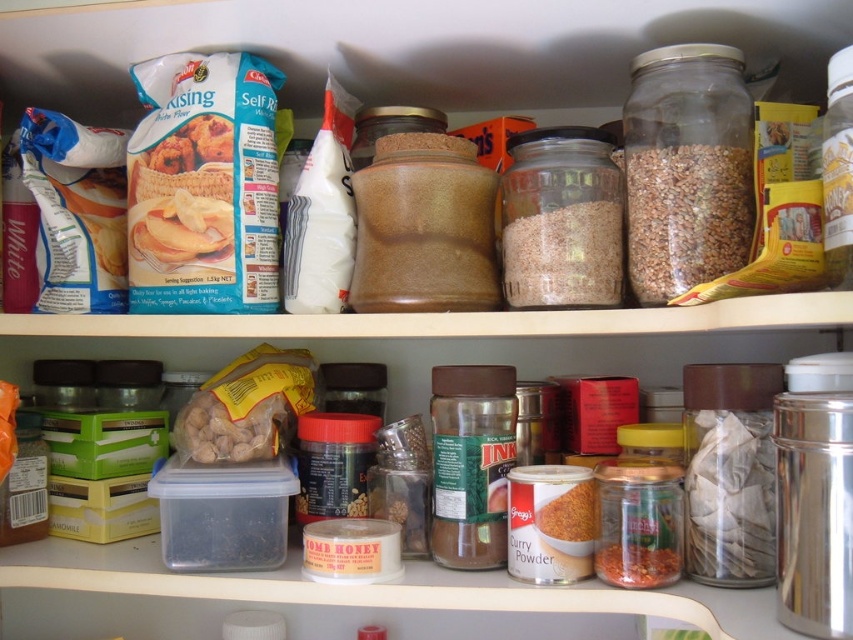
Measure the distance between point (747, 212) and camera.

28.10 inches

Identify the location of brown matte grain at upper right. The image size is (853, 640). (685, 216).

Find the location of a particular element. brown matte grain at upper right is located at coordinates (685, 216).

Does translucent glass jar at center come behind reddish-brown powder at lower center?

That is True.

Is point (531, 237) positioned in front of point (608, 545)?

No, (531, 237) is behind (608, 545).

The height and width of the screenshot is (640, 853). What are the coordinates of `translucent glass jar at center` in the screenshot? It's located at (564, 257).

Is brown matte grain at upper right bigger than translucent glass jar at center?

Yes, brown matte grain at upper right is bigger than translucent glass jar at center.

In the scene shown: Measure the distance between point (643, 298) and camera.

Point (643, 298) and camera are 28.55 inches apart.

I want to click on brown matte grain at upper right, so click(x=685, y=216).

Locate an element on the screen. The height and width of the screenshot is (640, 853). brown matte grain at upper right is located at coordinates (685, 216).